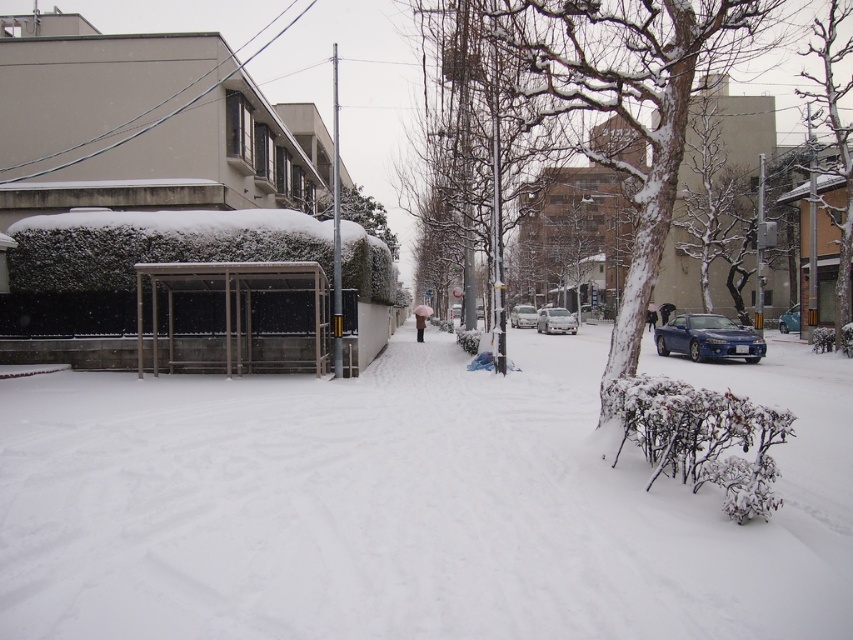
You are standing at the bus stop shelter on the left side of the image. Looking towards the center of the image, you see a person holding a pink umbrella walking along the snow. To your right, there is a point marked at coordinates (834, 134). What object does this point indicate?

The point at (834, 134) indicates the snow covered tree at right.

You are standing at the bus stop shelter on the left side of the snowy street. You want to take a photo of the point at coordinates point (851,72) and point (715,320). Which point should you focus on first to ensure both are in focus?

You should focus on point (851,72) first because it is closer to the camera than point (715,320), ensuring both points are within the depth of field.